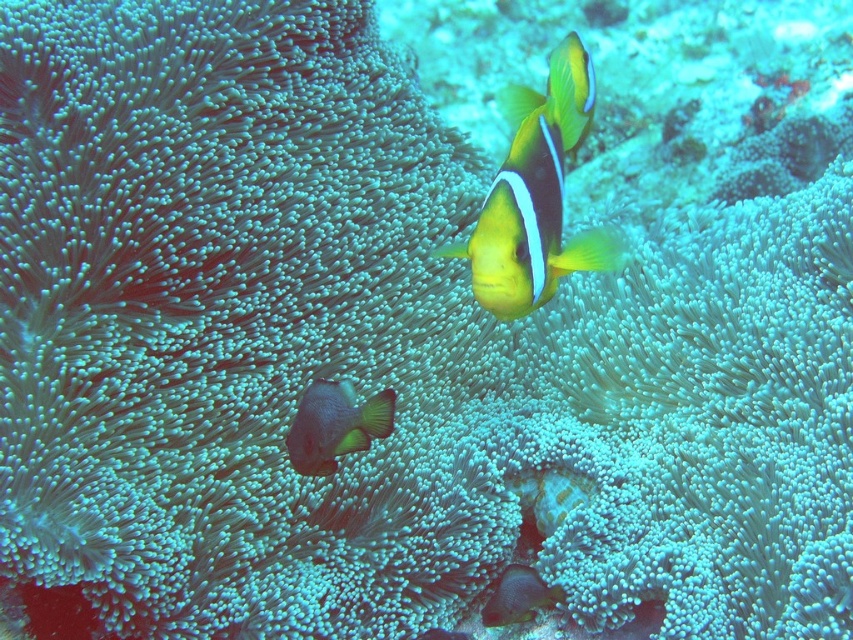
Between yellow matte clownfish at center and matte gray fish at center, which one has less height?

With less height is matte gray fish at center.

Can you confirm if yellow matte clownfish at center is smaller than matte gray fish at center?

No, yellow matte clownfish at center is not smaller than matte gray fish at center.

Describe the element at coordinates (537, 195) in the screenshot. The width and height of the screenshot is (853, 640). I see `yellow matte clownfish at center` at that location.

The height and width of the screenshot is (640, 853). Find the location of `yellow matte clownfish at center`. yellow matte clownfish at center is located at coordinates click(x=537, y=195).